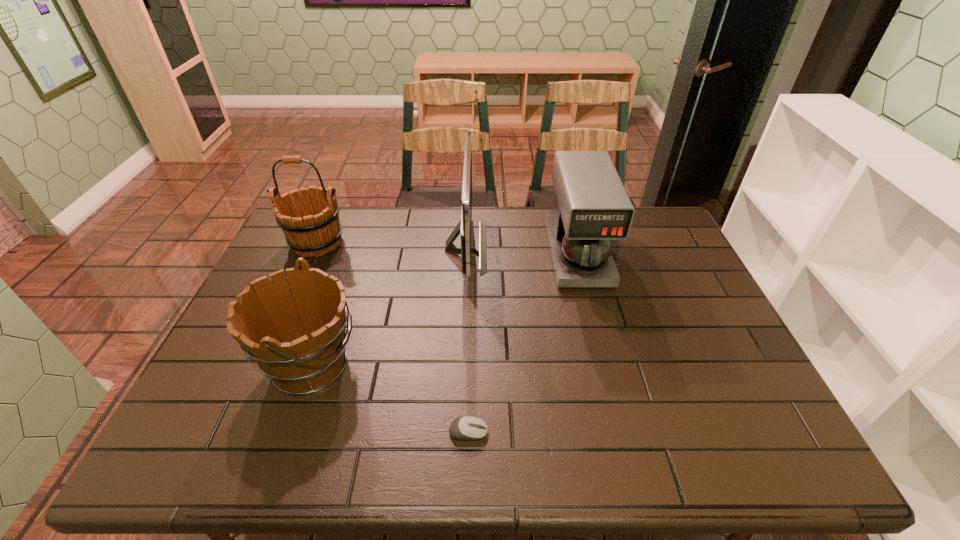
This screenshot has width=960, height=540. Find the location of `free space between the taller wine bucket and the shortest object`. free space between the taller wine bucket and the shortest object is located at coordinates (393, 338).

Locate an element on the screen. free space between the shortest object and the fourth farthest object is located at coordinates (390, 399).

I want to click on object that is the fourth nearest to the rightmost object, so click(x=318, y=231).

Choose which object is the third nearest neighbor to the taller wine bucket. Please provide its 2D coordinates. Your answer should be formatted as a tuple, i.e. [(x, y)], where the tuple contains the x and y coordinates of a point satisfying the conditions above.

[(591, 207)]

Image resolution: width=960 pixels, height=540 pixels. I want to click on blank area in the image that satisfies the following two spatial constraints: 1. on the carafe side of the coffee maker; 2. on the wheel side of the nearest object, so click(x=624, y=432).

The width and height of the screenshot is (960, 540). I want to click on free location that satisfies the following two spatial constraints: 1. on the carafe side of the rightmost object; 2. with the handle on the shorter wine bucket, so click(x=607, y=366).